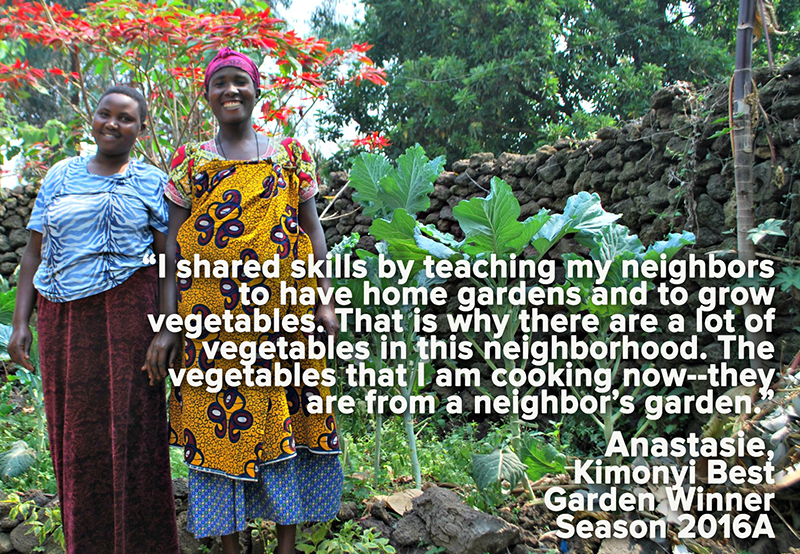
You are a GUI agent. You are given a task and a screenshot of the screen. Output one action in this format:
    pyautogui.click(x=<x>, y=<y>)
    Task: Click on the natural stone wall
    This screenshot has width=800, height=554.
    Given the screenshot: What is the action you would take?
    pyautogui.click(x=618, y=179)